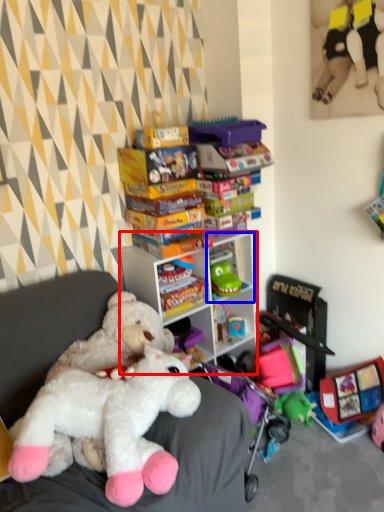
Question: Which of the following is the farthest to the observer, cabinetry (highlighted by a red box) or shelf (highlighted by a blue box)?

Choices:
 (A) cabinetry
 (B) shelf

Answer: (B)